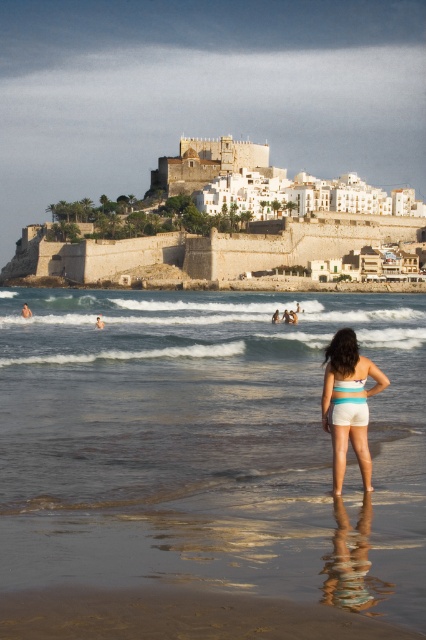
Question: Estimate the real-world distances between objects in this image. Which object is closer to the multicolored fabric bikini top at center?

Choices:
 (A) clear water at center
 (B) blue striped shorts at center
 (C) white matte bikini at center

Answer: (C)

Question: Can you confirm if clear water at center is positioned above multicolored fabric bikini top at center?

Choices:
 (A) no
 (B) yes

Answer: (B)

Question: Where is white matte bikini at center located in relation to multicolored fabric bikini top at center in the image?

Choices:
 (A) above
 (B) below

Answer: (B)

Question: Which object is the closest to the white matte bikini at center?

Choices:
 (A) clear water at center
 (B) blue striped shorts at center

Answer: (B)

Question: Which of these objects is positioned farthest from the blue striped shorts at center?

Choices:
 (A) white matte bikini at center
 (B) multicolored fabric bikini top at center

Answer: (B)

Question: Can you confirm if blue striped shorts at center is thinner than multicolored fabric bikini top at center?

Choices:
 (A) no
 (B) yes

Answer: (A)